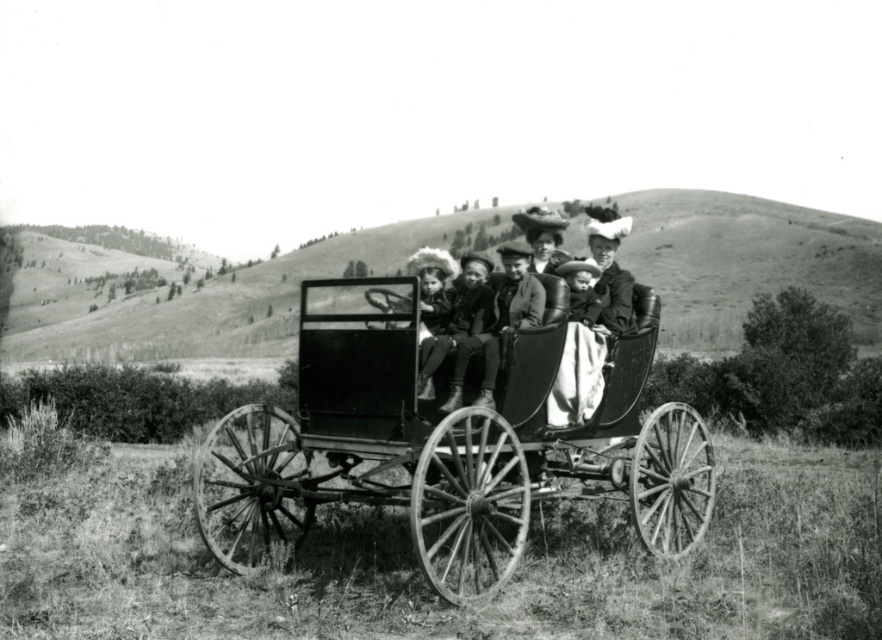
Question: Is matte black carriage at center thinner than smooth fabric baby at center?

Choices:
 (A) no
 (B) yes

Answer: (A)

Question: Which object appears closest to the camera in this image?

Choices:
 (A) smooth fabric baby at center
 (B) wooden wagon at center

Answer: (B)

Question: Estimate the real-world distances between objects in this image. Which object is closer to the matte black carriage at center?

Choices:
 (A) smooth fabric baby at center
 (B) wooden wagon at center

Answer: (A)

Question: Which point is closer to the camera?

Choices:
 (A) smooth fabric baby at center
 (B) matte black carriage at center
 (C) wooden wagon at center

Answer: (C)

Question: Does wooden wagon at center appear over smooth fabric baby at center?

Choices:
 (A) yes
 (B) no

Answer: (B)

Question: Is matte black carriage at center below smooth fabric baby at center?

Choices:
 (A) yes
 (B) no

Answer: (B)